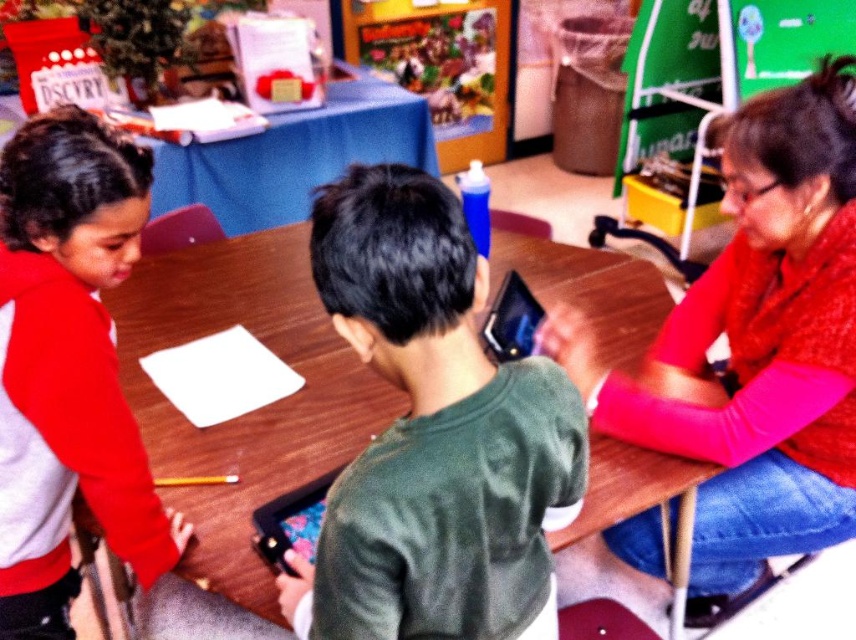
Can you confirm if green matte shirt at center is wider than wooden table at center?

Incorrect, green matte shirt at center's width does not surpass wooden table at center's.

Who is lower down, green matte shirt at center or wooden table at center?

Positioned lower is wooden table at center.

Identify the location of green matte shirt at center. The width and height of the screenshot is (856, 640). (432, 435).

Which is below, green matte shirt at center or red sweater at right?

red sweater at right is below.

Is green matte shirt at center taller than red sweater at right?

Incorrect, green matte shirt at center's height is not larger of red sweater at right's.

Who is more forward, (521, 413) or (819, 100)?

Positioned in front is point (521, 413).

This screenshot has height=640, width=856. I want to click on green matte shirt at center, so click(432, 435).

From the picture: Who is lower down, wooden table at center or red fleece jacket at left?

wooden table at center

Who is positioned more to the left, wooden table at center or red fleece jacket at left?

From the viewer's perspective, red fleece jacket at left appears more on the left side.

Does point (224, 262) lie in front of point (100, 515)?

That is False.

At what (x,y) coordinates should I click in order to perform the action: click on wooden table at center. Please return your answer as a coordinate pair (x, y). Looking at the image, I should click on (254, 410).